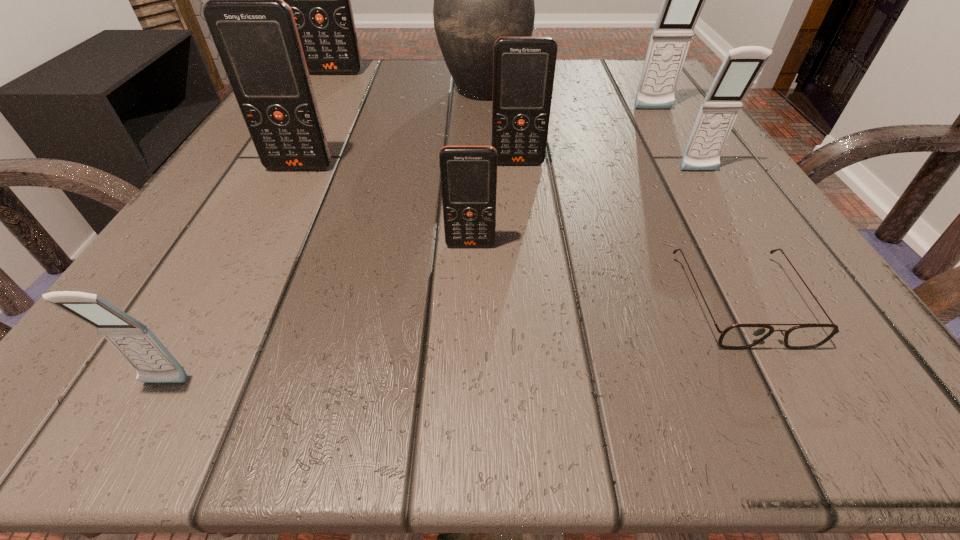
Identify the location of pitcher. The width and height of the screenshot is (960, 540). (477, 0).

The height and width of the screenshot is (540, 960). I want to click on the farthest cellular telephone, so click(x=320, y=0).

The image size is (960, 540). In order to click on the farthest orange cellular telephone in this screenshot , I will do `click(320, 0)`.

You are a GUI agent. You are given a task and a screenshot of the screen. Output one action in this format:
    pyautogui.click(x=<x>, y=<y>)
    Task: Click on the biggest gray cellular telephone
    
    Given the screenshot: What is the action you would take?
    pyautogui.click(x=683, y=0)

Where is `the farthest gray cellular telephone`? This screenshot has width=960, height=540. the farthest gray cellular telephone is located at coordinates (683, 0).

The image size is (960, 540). In order to click on the third smallest orange cellular telephone in this screenshot , I will do `click(254, 31)`.

At what (x,y) coordinates should I click in order to perform the action: click on the second nearest gray cellular telephone. Please return your answer as a coordinate pair (x, y). The image size is (960, 540). Looking at the image, I should click on (742, 65).

This screenshot has width=960, height=540. What are the coordinates of `the third biggest orange cellular telephone` in the screenshot? It's located at (523, 67).

You are a GUI agent. You are given a task and a screenshot of the screen. Output one action in this format:
    pyautogui.click(x=<x>, y=<y>)
    Task: Click on the third nearest object
    
    Given the screenshot: What is the action you would take?
    pyautogui.click(x=468, y=174)

You are a GUI agent. You are given a task and a screenshot of the screen. Output one action in this format:
    pyautogui.click(x=<x>, y=<y>)
    Task: Click on the second nearest cellular telephone
    The height and width of the screenshot is (540, 960).
    Given the screenshot: What is the action you would take?
    pyautogui.click(x=468, y=174)